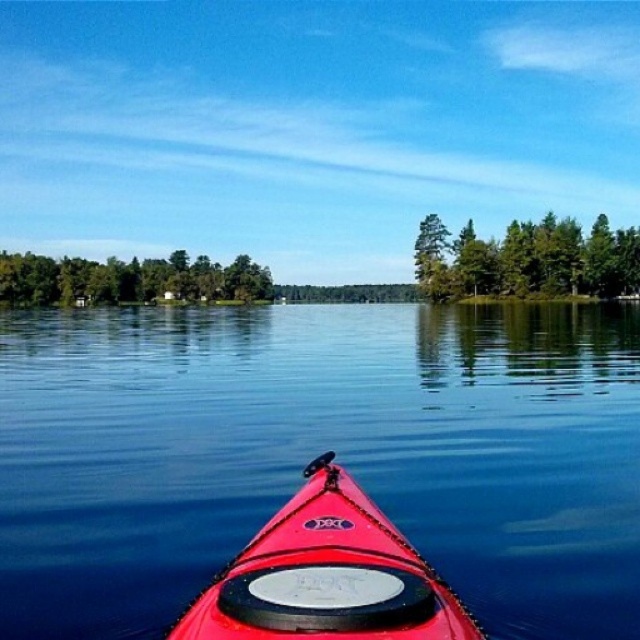
Is shiny red kayak at center wider than green textured trees at upper center?

No.

Identify the location of shiny red kayak at center. (326, 577).

Is point (412, 563) closer to viewer compared to point (598, 216)?

Yes, point (412, 563) is in front of point (598, 216).

Where is `shiny red kayak at center`? The image size is (640, 640). shiny red kayak at center is located at coordinates (326, 577).

Can you confirm if shiny red kayak at center is smaller than green leafy trees at center?

Indeed, shiny red kayak at center has a smaller size compared to green leafy trees at center.

Who is more forward, (x=440, y=637) or (x=140, y=262)?

Point (x=440, y=637)

Is point (337, 561) less distant than point (51, 266)?

That is True.

The image size is (640, 640). Find the location of `shiny red kayak at center`. shiny red kayak at center is located at coordinates (326, 577).

Which of these two, transparent blue water at center or green leafy trees at center, stands taller?

With more height is green leafy trees at center.

Measure the distance from transparent blue water at center to green leafy trees at center.

The distance of transparent blue water at center from green leafy trees at center is 88.93 meters.

The image size is (640, 640). What do you see at coordinates (317, 452) in the screenshot?
I see `transparent blue water at center` at bounding box center [317, 452].

This screenshot has width=640, height=640. I want to click on transparent blue water at center, so click(x=317, y=452).